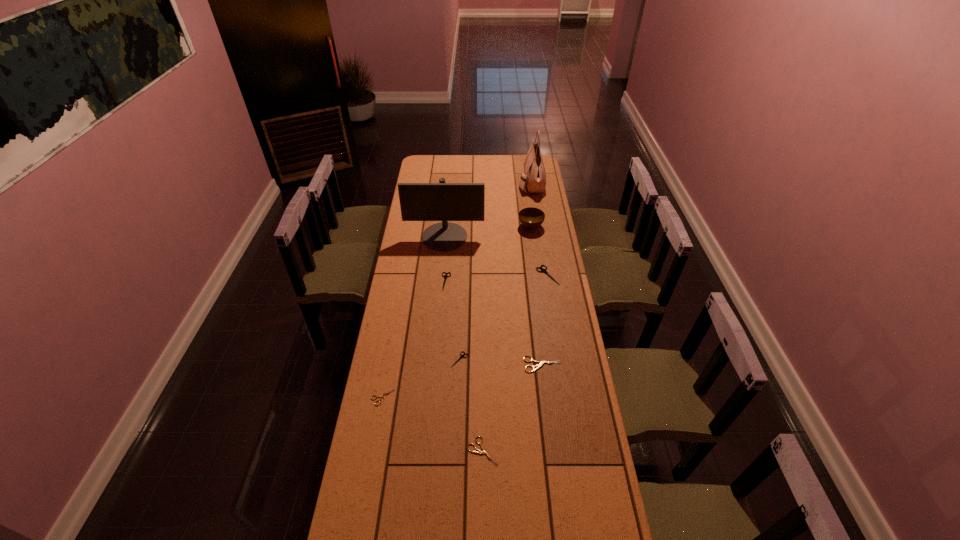
This screenshot has width=960, height=540. Find the location of `the second beige shears from left to right`. the second beige shears from left to right is located at coordinates (483, 451).

You are a GUI agent. You are given a task and a screenshot of the screen. Output one action in this format:
    pyautogui.click(x=<x>, y=<y>)
    Task: Click on the smallest black shears
    This screenshot has width=960, height=540.
    Given the screenshot: What is the action you would take?
    pyautogui.click(x=461, y=356)

Locate an element on the screen. the second black shears from right to left is located at coordinates (461, 356).

Image resolution: width=960 pixels, height=540 pixels. Identify the location of the smallest beige shears. (383, 395).

You are a GUI agent. You are given a task and a screenshot of the screen. Output one action in this format:
    pyautogui.click(x=<x>, y=<y>)
    Task: Click on the second nearest shears
    The width and height of the screenshot is (960, 540).
    Given the screenshot: What is the action you would take?
    pyautogui.click(x=383, y=395)

This screenshot has width=960, height=540. In order to click on free space located 0.240m on the side of the farthest object with the attached pouch in this screenshot , I will do `click(478, 183)`.

Locate an element on the screen. The height and width of the screenshot is (540, 960). free point located on the side of the farthest object with the attached pouch is located at coordinates (501, 183).

Identify the location of vacant space located on the side of the farthest object with the attached pouch. [496, 183].

The image size is (960, 540). What are the coordinates of `vacant space located 0.280m on the screen of the computer monitor` in the screenshot? It's located at pos(440,291).

Where is `vacant space located 0.260m on the front of the third tallest object`? The image size is (960, 540). vacant space located 0.260m on the front of the third tallest object is located at coordinates (537, 268).